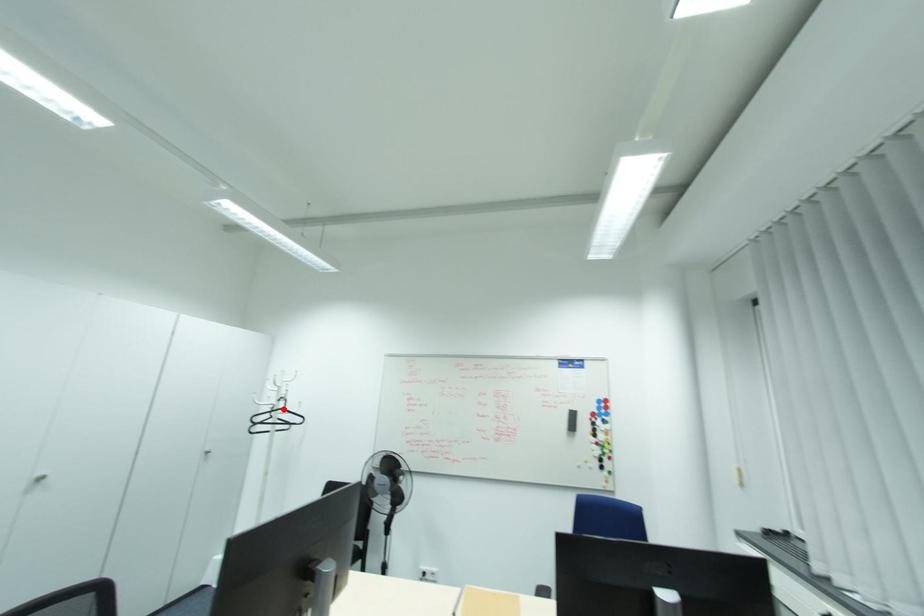
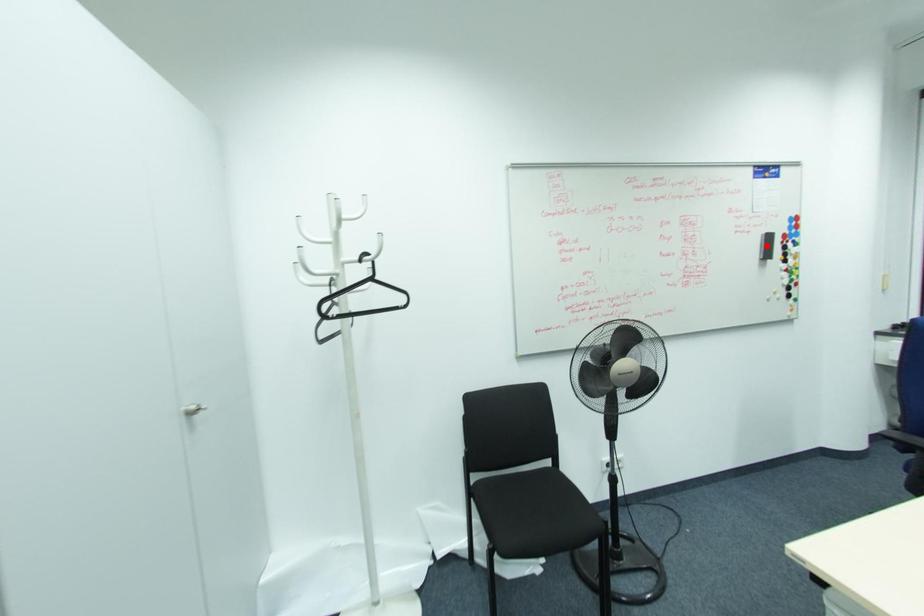
I am providing you with two images of the same scene from different viewpoints. A red point is marked on the first image and another point is marked on the second image. Does the point marked in image1 correspond to the same location as the one in image2?

No